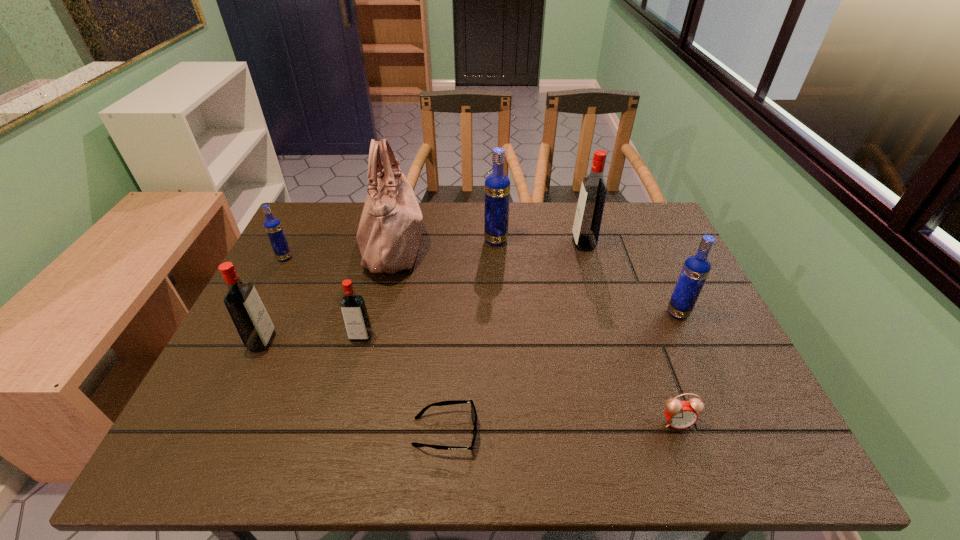
You are a GUI agent. You are given a task and a screenshot of the screen. Output one action in this format:
    pyautogui.click(x=<x>, y=<y>)
    Task: Click on the vacant space located on the front and back of the biggest red vodka
    The height and width of the screenshot is (540, 960).
    Given the screenshot: What is the action you would take?
    pyautogui.click(x=498, y=243)

At what (x,y) coordinates should I click in order to perform the action: click on vacant region located 0.080m on the left of the biggest blue vodka. Please return your answer as a coordinate pair (x, y). Looking at the image, I should click on (458, 240).

Locate an element on the screen. This screenshot has width=960, height=540. vacant area located 0.050m on the front and back of the leftmost red vodka is located at coordinates (294, 341).

The image size is (960, 540). Find the location of `vacant space located on the left of the fourth farthest vodka`. vacant space located on the left of the fourth farthest vodka is located at coordinates (550, 313).

At what (x,y) coordinates should I click in order to perform the action: click on vacant area situated on the front of the smallest blue vodka. Please return your answer as a coordinate pair (x, y). This screenshot has height=540, width=960. Looking at the image, I should click on (227, 370).

At what (x,y) coordinates should I click in order to perform the action: click on free spot located on the front and back of the second red vodka from left to right. Please return your answer as a coordinate pair (x, y). This screenshot has width=960, height=540. Looking at the image, I should click on (351, 374).

At what (x,y) coordinates should I click in order to perform the action: click on blank space located 0.230m on the front-facing side of the sunglasses. Please return your answer as a coordinate pair (x, y). This screenshot has width=960, height=540. Looking at the image, I should click on click(x=591, y=431).

Locate an element on the screen. The width and height of the screenshot is (960, 540). handbag that is at the far edge is located at coordinates (389, 232).

In order to click on alarm clock that is at the near edge in this screenshot , I will do `click(680, 414)`.

Image resolution: width=960 pixels, height=540 pixels. In order to click on sunglasses situated at the near edge in this screenshot , I will do `click(473, 411)`.